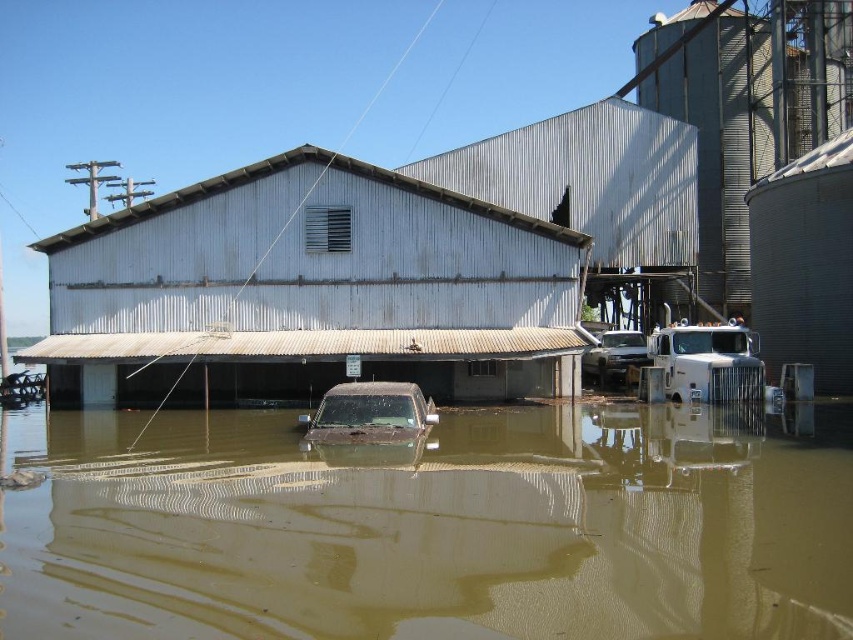
Does brown muddy water at center have a larger size compared to white corrugated metal barn at center?

No.

Is point (345, 474) positioned before point (262, 392)?

Yes, point (345, 474) is closer to viewer.

The width and height of the screenshot is (853, 640). In order to click on brown muddy water at center in this screenshot , I will do `click(431, 528)`.

Between brown muddy water at center and muddy brown truck at center, which one has more height?

brown muddy water at center is taller.

Is brown muddy water at center to the right of muddy brown truck at center from the viewer's perspective?

Correct, you'll find brown muddy water at center to the right of muddy brown truck at center.

Where is `brown muddy water at center`? brown muddy water at center is located at coordinates (431, 528).

Can you confirm if white corrugated metal barn at center is positioned to the right of muddy brown truck at center?

No, white corrugated metal barn at center is not to the right of muddy brown truck at center.

Is white corrugated metal barn at center positioned behind muddy brown truck at center?

Yes.

Is point (370, 289) more distant than point (355, 388)?

Yes, it is.

Locate an element on the screen. white corrugated metal barn at center is located at coordinates (309, 291).